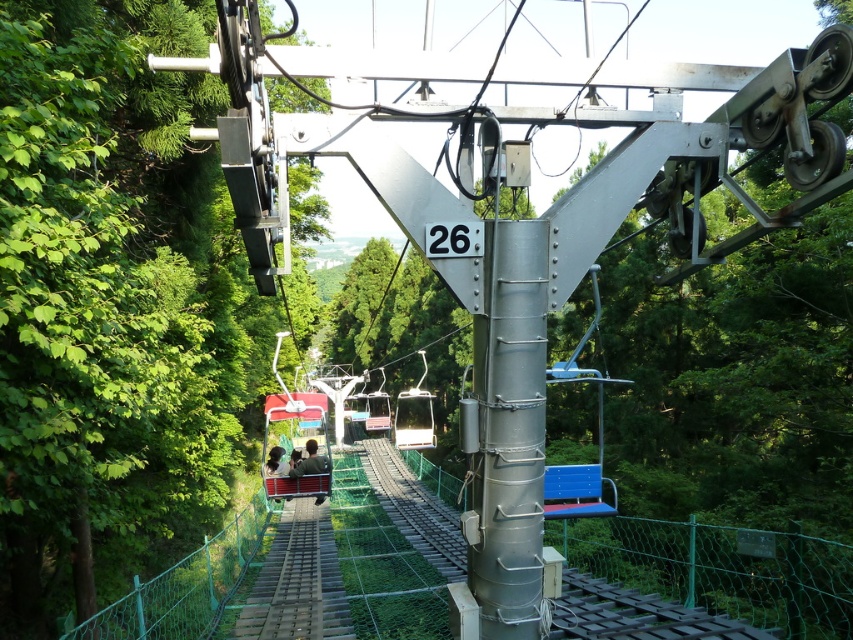
You are a passenger on the cable car and want to take a photo of the mountain view. However, there is a green fabric jacket at center and a matte black jacket at center in your way. Which jacket do you need to ask to move so you can get a clear view?

The matte black jacket at center is behind the green fabric jacket at center, so you need to ask the person wearing the green fabric jacket at center to move as they are blocking the view.